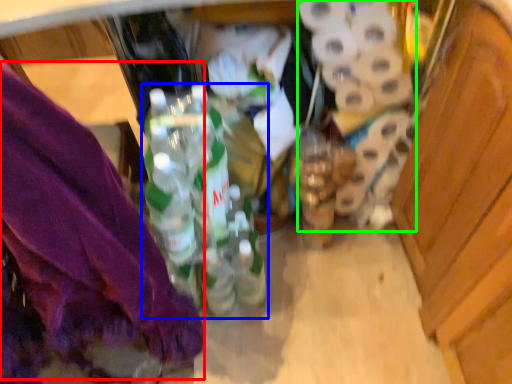
Question: Estimate the real-world distances between objects in this image. Which object is closer to underclothes (highlighted by a red box), bottle (highlighted by a blue box) or toilet paper (highlighted by a green box)?

Choices:
 (A) bottle
 (B) toilet paper

Answer: (A)